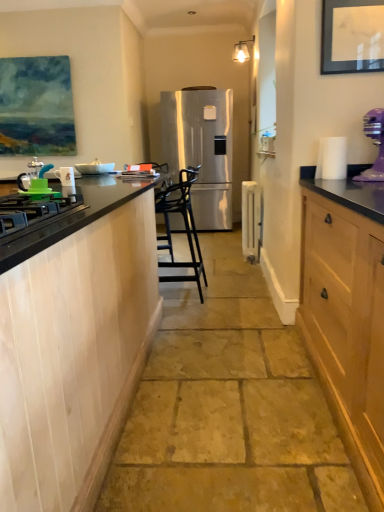
Question: From a real-world perspective, is black matte gas stove at left physically located above or below white glossy bowl at center, which appears as the 3th appliance when viewed from the front?

Choices:
 (A) above
 (B) below

Answer: (B)

Question: Choose the correct answer: Is black matte gas stove at left inside white glossy bowl at center, which appears as the 3th appliance when viewed from the front, or outside it?

Choices:
 (A) inside
 (B) outside

Answer: (B)

Question: Which object is positioned closest to the green matte kettle at left, acting as the 2th appliance starting from the right?

Choices:
 (A) black metal bar stool at center
 (B) matte black picture frame at upper right
 (C) white glossy bowl at center, the second appliance in the back-to-front sequence
 (D) purple plastic mixer at right
 (E) satin silver refrigerator at center

Answer: (C)

Question: Considering the real-world distances, which object is farthest from the white metallic radiator at center, positioned as the first appliance in right-to-left order?

Choices:
 (A) black metal bar stool at center
 (B) white glossy mug at left, marked as the 3th appliance in a right-to-left arrangement
 (C) matte black picture frame at upper right
 (D) black matte gas stove at left
 (E) purple plastic mixer at right

Answer: (D)